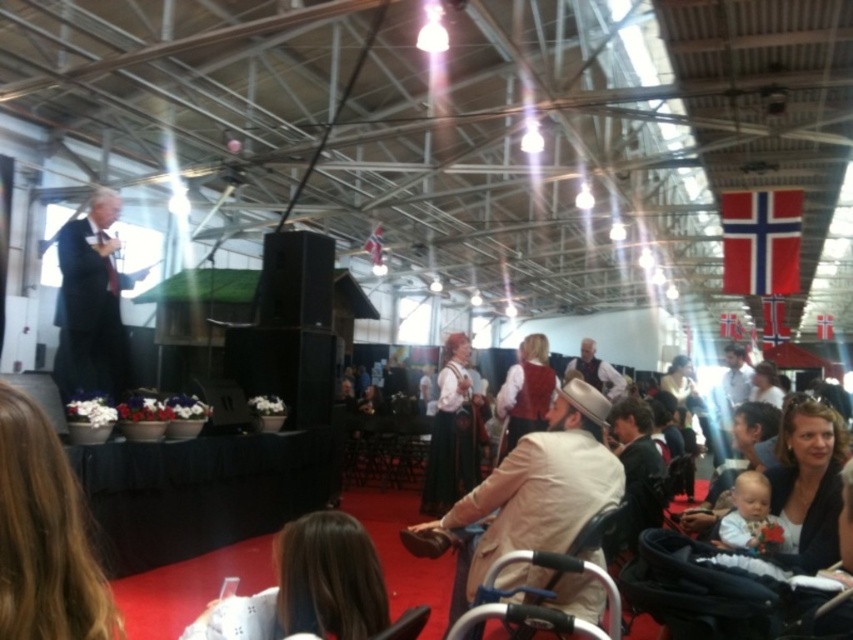
Question: Which of the following is the closest to the observer?

Choices:
 (A) beige fabric coat at center
 (B) white soft baby at lower right

Answer: (A)

Question: Which is nearer to the white soft baby at lower right?

Choices:
 (A) matte brown hat at center
 (B) matte black jacket at lower right
 (C) black plastic baby carriage at lower center

Answer: (B)

Question: Can you confirm if brown hair at lower left is wider than white soft baby at lower right?

Choices:
 (A) yes
 (B) no

Answer: (B)

Question: Which of these objects is positioned farthest from the matte brown hat at center?

Choices:
 (A) brown hair at lower center
 (B) black plastic baby carriage at lower center
 (C) beige fabric coat at center
 (D) brown hair at lower left

Answer: (D)

Question: Is beige fabric coat at center below brown hair at lower left?

Choices:
 (A) yes
 (B) no

Answer: (A)

Question: Does black plastic baby carriage at lower center appear on the left side of matte white blouse at center?

Choices:
 (A) yes
 (B) no

Answer: (B)